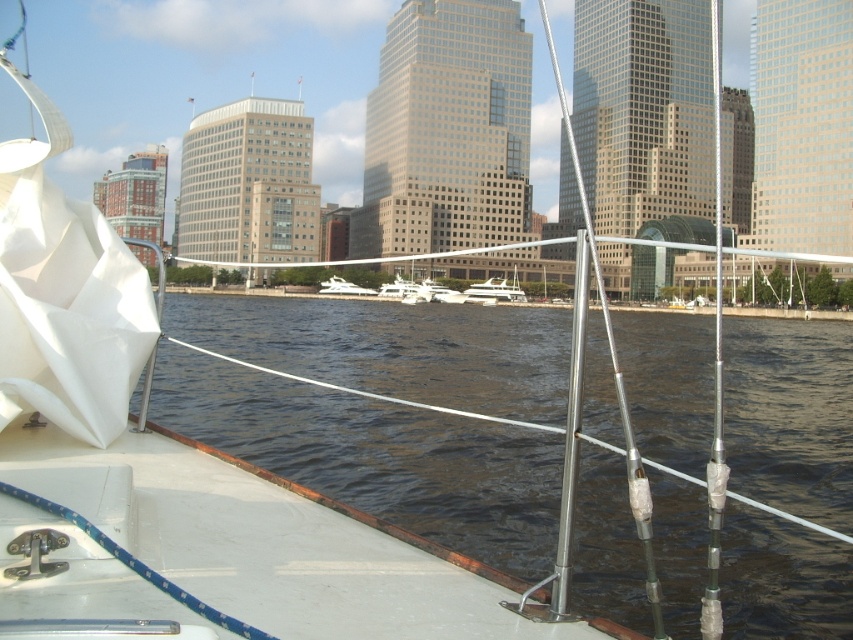
Is white glossy yacht at center closer to camera compared to white glossy boat at center?

Yes, it is.

Can you confirm if white glossy yacht at center is positioned to the left of white glossy boat at center?

No, white glossy yacht at center is not to the left of white glossy boat at center.

Who is more forward, (502, 284) or (357, 289)?

Positioned in front is point (357, 289).

Locate an element on the screen. This screenshot has width=853, height=640. white glossy yacht at center is located at coordinates (495, 291).

Does dark blue water at center lie behind white glossy boat at center?

No, dark blue water at center is closer to the viewer.

Which is behind, point (173, 426) or point (322, 284)?

Positioned behind is point (322, 284).

I want to click on dark blue water at center, so click(378, 456).

Is the position of dark blue water at center more distant than that of white glossy yacht at center?

No, it is in front of white glossy yacht at center.

This screenshot has height=640, width=853. Describe the element at coordinates (378, 456) in the screenshot. I see `dark blue water at center` at that location.

At what (x,y) coordinates should I click in order to perform the action: click on dark blue water at center. Please return your answer as a coordinate pair (x, y). Looking at the image, I should click on (378, 456).